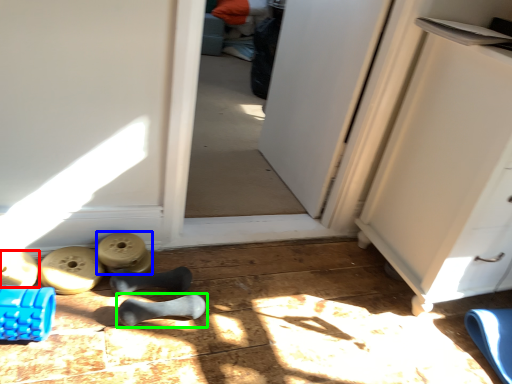
Question: Estimate the real-world distances between objects in this image. Which object is farther from footwear (highlighted by a red box), job (highlighted by a blue box) or footwear (highlighted by a green box)?

Choices:
 (A) job
 (B) footwear

Answer: (B)